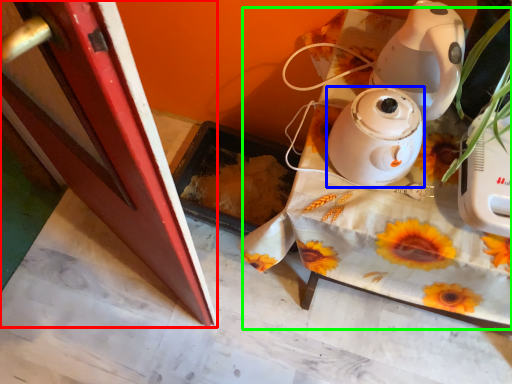
Question: Estimate the real-world distances between objects in this image. Which object is closer to screen door (highlighted by a red box), home appliance (highlighted by a blue box) or table (highlighted by a green box)?

Choices:
 (A) home appliance
 (B) table

Answer: (B)